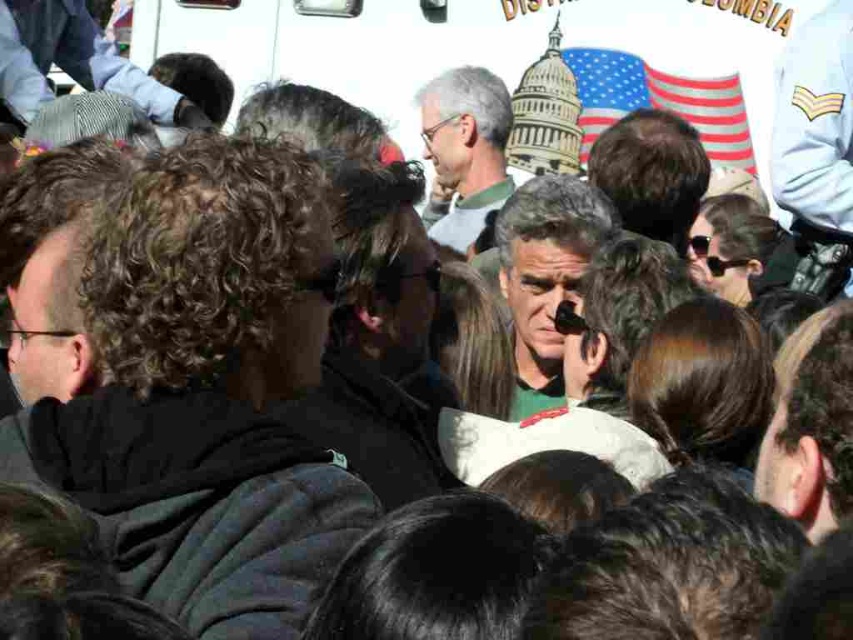
Question: Is gray hair man at center further to the viewer compared to matte green shirt at center?

Choices:
 (A) no
 (B) yes

Answer: (A)

Question: Which object is the farthest from the dark curly hair at center?

Choices:
 (A) gray hair man at center
 (B) matte green shirt at center

Answer: (B)

Question: Is gray hair man at center wider than matte green shirt at center?

Choices:
 (A) yes
 (B) no

Answer: (A)

Question: Is gray hair man at center to the left of matte green shirt at center from the viewer's perspective?

Choices:
 (A) no
 (B) yes

Answer: (A)

Question: Which of the following is the closest to the observer?

Choices:
 (A) matte green shirt at center
 (B) gray hair man at center

Answer: (B)

Question: Among these points, which one is farthest from the camera?

Choices:
 (A) (514, 340)
 (B) (263, 275)

Answer: (A)